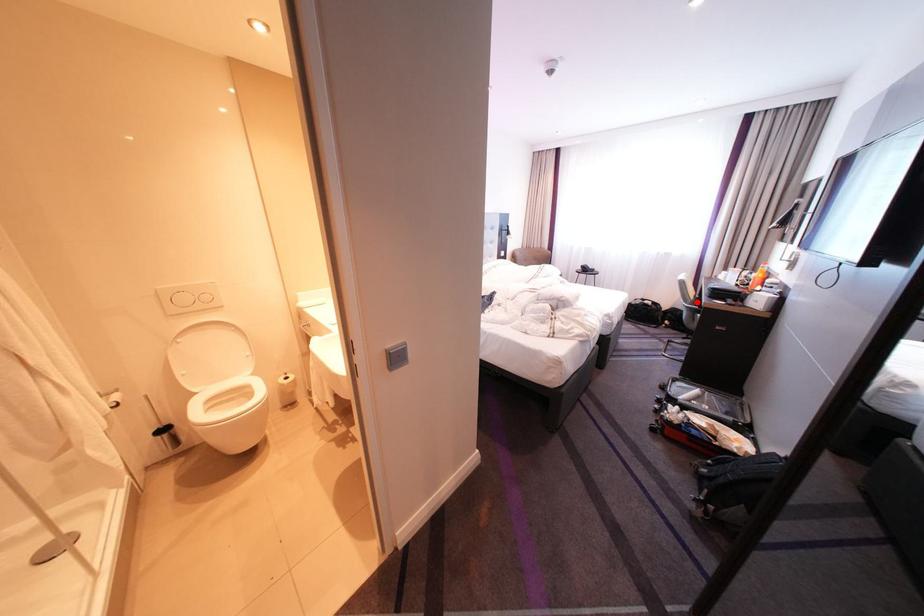
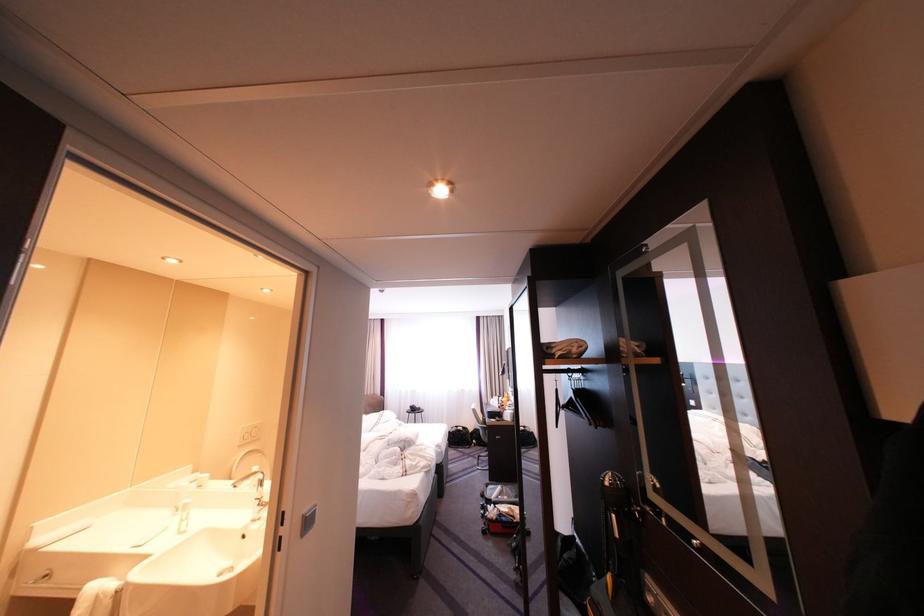
In the second image, find the point that corresponds to the highlighted location in the first image.

(491, 424)